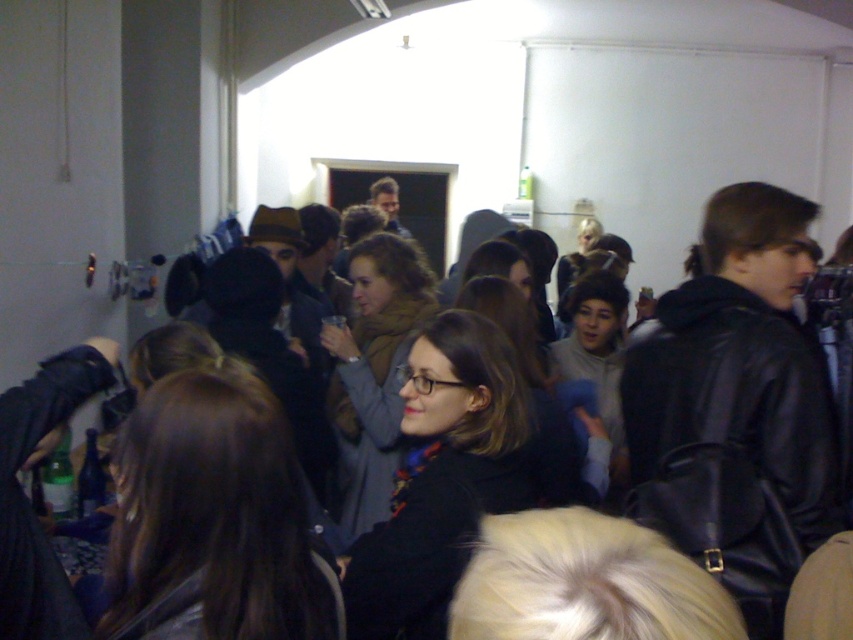
Question: Among these objects, which one is farthest from the camera?

Choices:
 (A) matte brown scarf at center
 (B) matte black coat at center
 (C) brown hair at center

Answer: (A)

Question: Is brown hair at center further to the viewer compared to matte black coat at center?

Choices:
 (A) no
 (B) yes

Answer: (A)

Question: Which point is farther to the camera?

Choices:
 (A) brown hair at center
 (B) matte black coat at center

Answer: (B)

Question: Is matte black coat at center bigger than matte brown scarf at center?

Choices:
 (A) yes
 (B) no

Answer: (B)

Question: Does brown hair at center appear under matte black coat at center?

Choices:
 (A) no
 (B) yes

Answer: (A)

Question: Which object appears closest to the camera in this image?

Choices:
 (A) brown hair at center
 (B) matte black coat at center
 (C) matte brown scarf at center

Answer: (A)